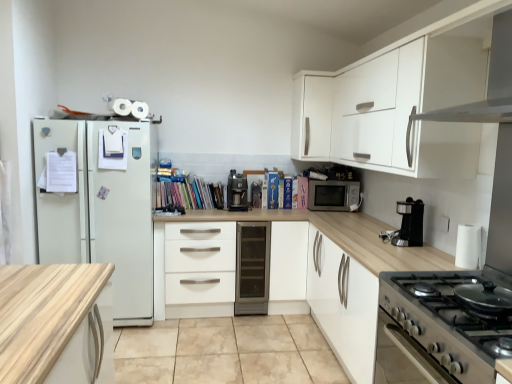
Question: Can you confirm if satin silver wine cooler at center is bigger than satin silver microwave at center?

Choices:
 (A) yes
 (B) no

Answer: (A)

Question: Does satin silver wine cooler at center lie in front of satin silver microwave at center?

Choices:
 (A) no
 (B) yes

Answer: (B)

Question: From the image's perspective, is satin silver wine cooler at center over satin silver microwave at center?

Choices:
 (A) yes
 (B) no

Answer: (B)

Question: Can satin silver microwave at center be found inside satin silver wine cooler at center?

Choices:
 (A) no
 (B) yes

Answer: (A)

Question: Is satin silver wine cooler at center at the right side of satin silver microwave at center?

Choices:
 (A) yes
 (B) no

Answer: (B)

Question: Looking at the image, does stainless steel gas stove at lower right seem bigger or smaller compared to beige tile at center?

Choices:
 (A) small
 (B) big

Answer: (A)

Question: Considering the relative positions of stainless steel gas stove at lower right and beige tile at center in the image provided, is stainless steel gas stove at lower right to the left or to the right of beige tile at center?

Choices:
 (A) left
 (B) right

Answer: (B)

Question: Considering their positions, is stainless steel gas stove at lower right located in front of or behind beige tile at center?

Choices:
 (A) behind
 (B) front

Answer: (B)

Question: In terms of width, does stainless steel gas stove at lower right look wider or thinner when compared to beige tile at center?

Choices:
 (A) wide
 (B) thin

Answer: (B)

Question: Is point (307, 79) positioned closer to the camera than point (258, 190)?

Choices:
 (A) closer
 (B) farther

Answer: (A)

Question: From the image's perspective, relative to metallic coffee maker at center, is white matte cabinet at upper right above or below?

Choices:
 (A) below
 (B) above

Answer: (B)

Question: Considering their positions, is white matte cabinet at upper right located in front of or behind metallic coffee maker at center?

Choices:
 (A) front
 (B) behind

Answer: (A)

Question: In terms of width, does white matte cabinet at upper right look wider or thinner when compared to metallic coffee maker at center?

Choices:
 (A) wide
 (B) thin

Answer: (A)

Question: Is point (197, 292) closer or farther from the camera than point (325, 104)?

Choices:
 (A) closer
 (B) farther

Answer: (A)

Question: Looking at their shapes, would you say white matte drawer at center is wider or thinner than white matte cabinet at upper right?

Choices:
 (A) wide
 (B) thin

Answer: (A)